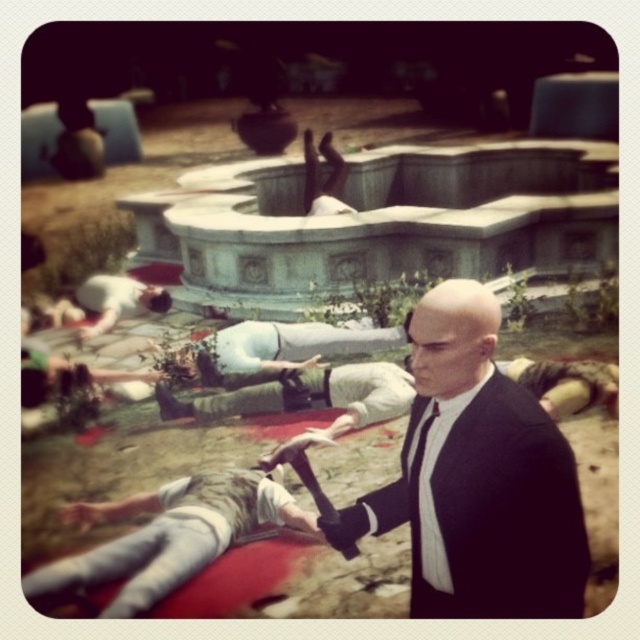
You are a security guard observing the scene. You notice two hands in the image. The first is a matte black hand at lower center, and the second is a smooth skin hand at center. Based on their positions, which hand is closer to the ground?

The matte black hand at lower center has a greater height compared to the smooth skin hand at center, so the smooth skin hand at center is closer to the ground.

You are a security guard observing the scene. You need to determine which person is wider between the black matte suit at center and the camouflage fabric body at center. Which one is wider?

The camouflage fabric body at center is wider than the black matte suit at center.